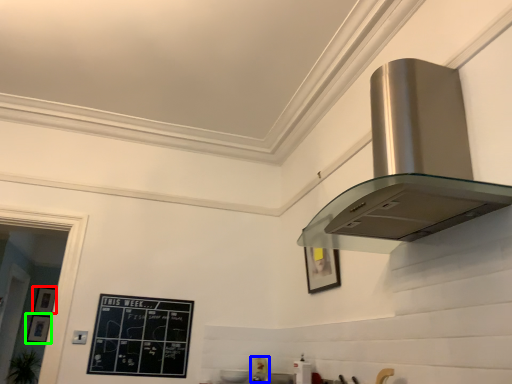
Question: Considering the real-world distances, which object is farthest from picture frame (highlighted by a red box)? appliance (highlighted by a blue box) or picture frame (highlighted by a green box)?

Choices:
 (A) appliance
 (B) picture frame

Answer: (A)